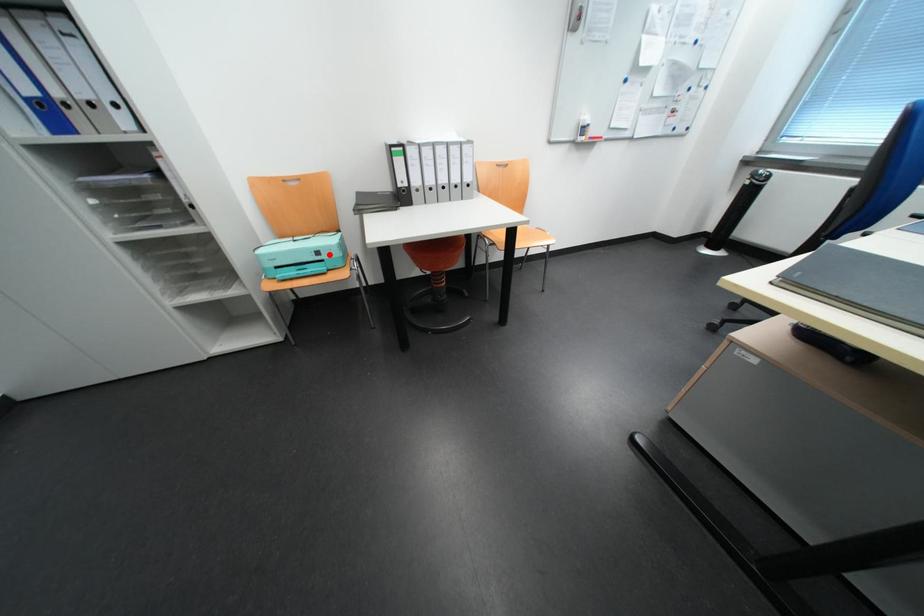
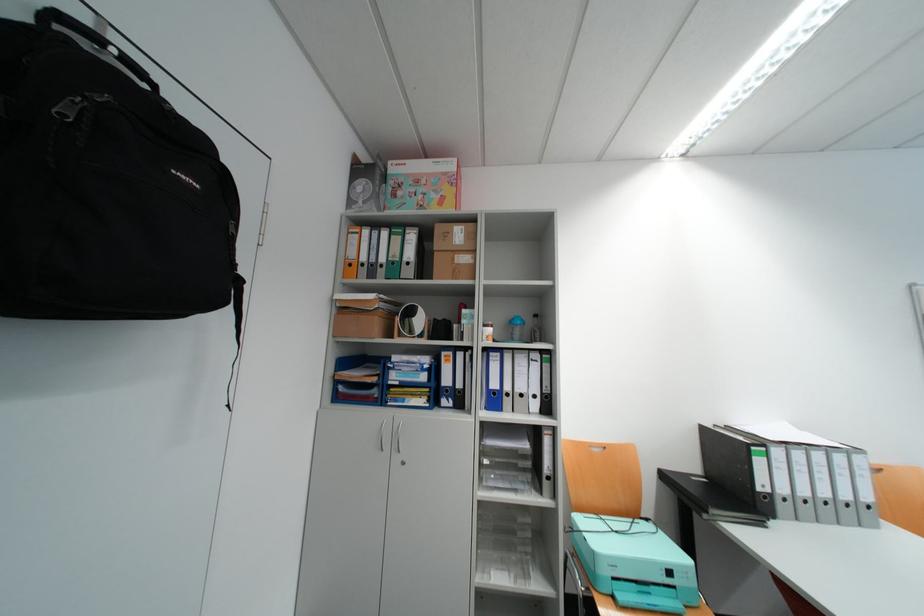
In the second image, find the point that corresponds to the highlighted location in the first image.

(682, 573)